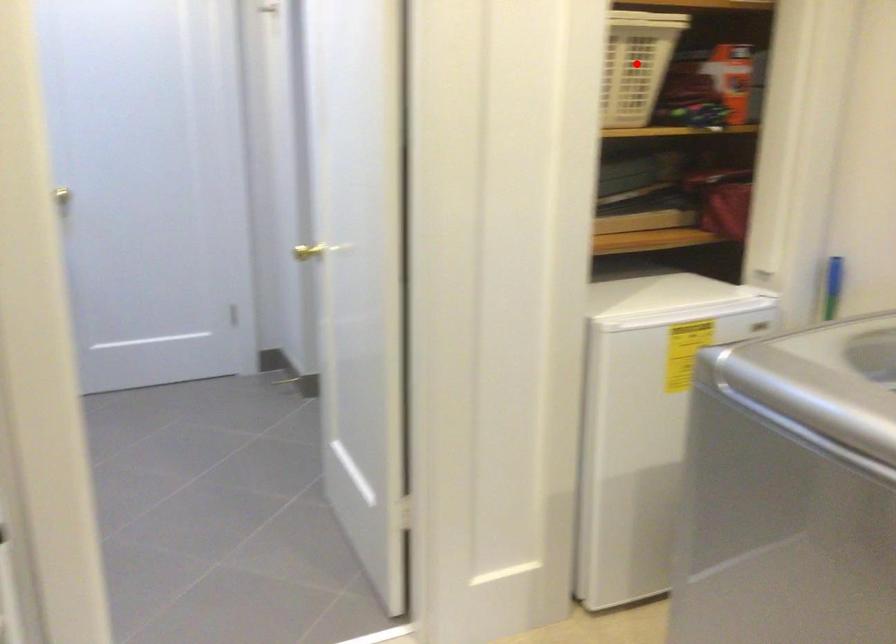
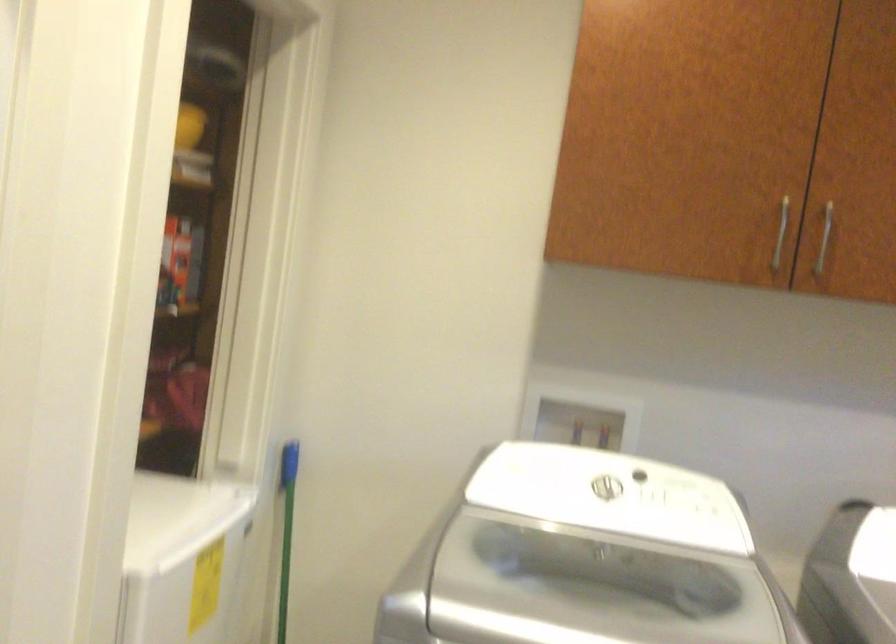
Question: I am providing you with two images of the same scene from different viewpoints. A red point is marked on the first image. At the location where the point appears in image 1, is it still visible in image 2?

Choices:
 (A) Yes
 (B) No

Answer: (B)